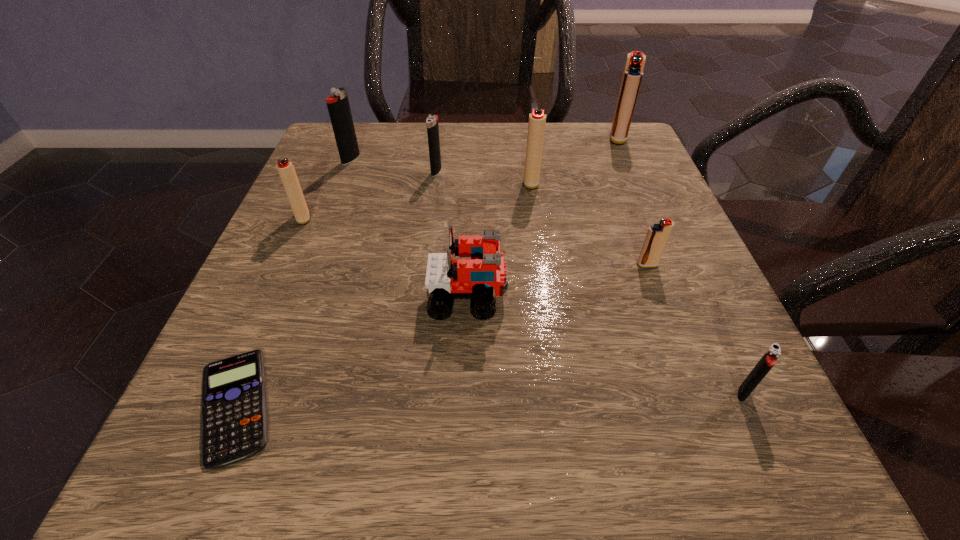
At what (x,y) coordinates should I click in order to perform the action: click on the fifth object from right to left. Please return your answer as a coordinate pair (x, y). This screenshot has height=540, width=960. Looking at the image, I should click on (446, 278).

You are a GUI agent. You are given a task and a screenshot of the screen. Output one action in this format:
    pyautogui.click(x=<x>, y=<y>)
    Task: Click on the red Lego
    The height and width of the screenshot is (540, 960).
    Given the screenshot: What is the action you would take?
    pyautogui.click(x=446, y=278)

The height and width of the screenshot is (540, 960). Identify the location of the third red igniter from left to right. (657, 236).

Find the location of a particular element. This screenshot has height=540, width=960. the fifth igniter from left to right is located at coordinates (657, 236).

Locate an element on the screen. the rightmost black igniter is located at coordinates (769, 359).

I want to click on the nearest igniter, so click(769, 359).

Identify the location of the shortest object. coord(234,420).

At what (x,y) coordinates should I click in order to perform the action: click on blue calculator. Please return your answer as a coordinate pair (x, y). This screenshot has height=540, width=960. Looking at the image, I should click on coord(234,420).

At what (x,y) coordinates should I click in order to perform the action: click on free space located 0.100m on the front of the tallest igniter. Please return your answer as a coordinate pair (x, y). This screenshot has height=540, width=960. Looking at the image, I should click on (632, 171).

Identify the location of vacant space located 0.110m on the back of the third nearest red igniter. (526, 146).